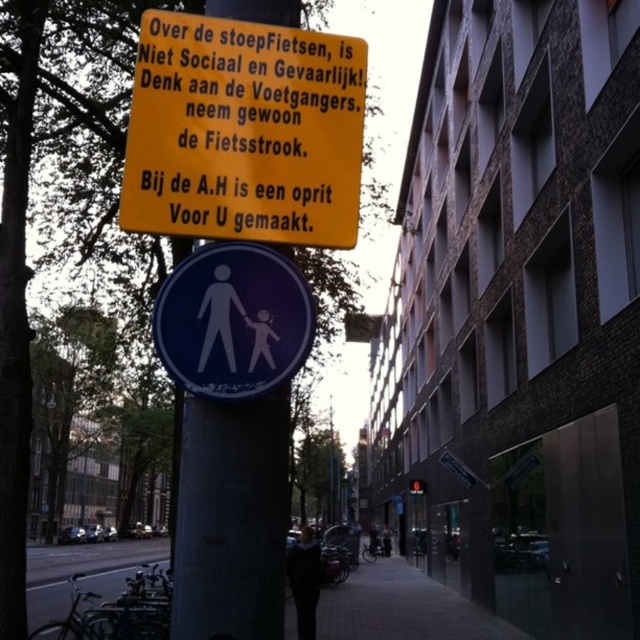
Question: Which point is farther to the camera?

Choices:
 (A) dark gray fabric jacket at center
 (B) blue glossy pedestrian sign at center
 (C) matte black pedestrian at center

Answer: (A)

Question: Can you confirm if blue glossy pedestrian sign at center is bigger than dark gray fabric jacket at center?

Choices:
 (A) no
 (B) yes

Answer: (A)

Question: Which object appears farthest from the camera in this image?

Choices:
 (A) dark gray sweater at center
 (B) dark gray fabric jacket at center
 (C) yellow plastic sign at upper center

Answer: (B)

Question: Does paved sidewalk at center have a smaller size compared to dark gray fabric jacket at center?

Choices:
 (A) no
 (B) yes

Answer: (A)

Question: Which object is closer to the camera taking this photo?

Choices:
 (A) matte black pedestrian at center
 (B) smooth gray pole at center
 (C) paved sidewalk at center
 (D) dark gray sweater at center

Answer: (C)

Question: Can you confirm if matte black pedestrian at center is positioned above dark gray fabric jacket at center?

Choices:
 (A) yes
 (B) no

Answer: (B)